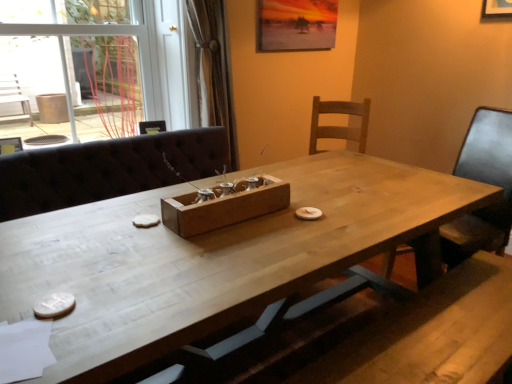
Question: From the image's perspective, is white wood table at center on wooden tray at center?

Choices:
 (A) yes
 (B) no

Answer: (B)

Question: Does white wood table at center have a smaller size compared to wooden tray at center?

Choices:
 (A) no
 (B) yes

Answer: (A)

Question: Is white wood table at center shorter than wooden tray at center?

Choices:
 (A) no
 (B) yes

Answer: (A)

Question: Would you say white wood table at center is outside wooden tray at center?

Choices:
 (A) no
 (B) yes

Answer: (B)

Question: Is white wood table at center wider than wooden tray at center?

Choices:
 (A) yes
 (B) no

Answer: (A)

Question: Does white wood table at center lie in front of wooden tray at center?

Choices:
 (A) yes
 (B) no

Answer: (A)

Question: From a real-world perspective, does wooden chair at right stand above white wood table at center?

Choices:
 (A) yes
 (B) no

Answer: (A)

Question: Does wooden chair at right have a greater width compared to white wood table at center?

Choices:
 (A) no
 (B) yes

Answer: (A)

Question: Does wooden chair at right have a lesser height compared to white wood table at center?

Choices:
 (A) no
 (B) yes

Answer: (A)

Question: From the image's perspective, is wooden chair at right on white wood table at center?

Choices:
 (A) yes
 (B) no

Answer: (A)

Question: Does wooden chair at right have a larger size compared to white wood table at center?

Choices:
 (A) yes
 (B) no

Answer: (B)

Question: Is wooden chair at right smaller than white wood table at center?

Choices:
 (A) yes
 (B) no

Answer: (A)

Question: Can you confirm if transparent glass door at upper left is positioned to the right of wooden chair at right?

Choices:
 (A) no
 (B) yes

Answer: (A)